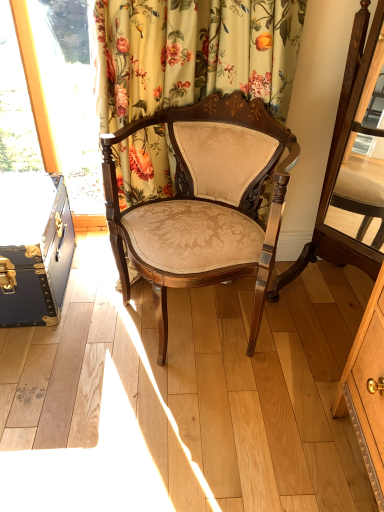
This screenshot has width=384, height=512. What do you see at coordinates (193, 54) in the screenshot?
I see `floral fabric curtain at upper center` at bounding box center [193, 54].

The width and height of the screenshot is (384, 512). What do you see at coordinates (34, 248) in the screenshot? I see `blue leather suitcase at left` at bounding box center [34, 248].

Find the location of a particular element. floral fabric curtain at upper center is located at coordinates (193, 54).

Are blue leather suitcase at left and floral fabric curtain at upper center far apart?

No, there isn't a large distance between blue leather suitcase at left and floral fabric curtain at upper center.

Is point (11, 312) closer or farther from the camera than point (229, 78)?

Clearly, point (11, 312) is more distant from the camera than point (229, 78).

From a real-world perspective, is blue leather suitcase at left positioned under floral fabric curtain at upper center based on gravity?

Yes.

In the scene shown: Is blue leather suitcase at left positioned with its back to floral fabric curtain at upper center?

blue leather suitcase at left does not have its back to floral fabric curtain at upper center.

From the image's perspective, between matte brown wood swivel chair at center and matte gold upholstery chair at center, which one is located above?

matte brown wood swivel chair at center, from the image's perspective.

Can you confirm if matte brown wood swivel chair at center is positioned to the left of matte gold upholstery chair at center?

No, matte brown wood swivel chair at center is not to the left of matte gold upholstery chair at center.

Considering the positions of objects matte brown wood swivel chair at center and matte gold upholstery chair at center in the image provided, who is behind, matte brown wood swivel chair at center or matte gold upholstery chair at center?

matte gold upholstery chair at center is further away from the camera.

Looking at this image, does matte brown wood swivel chair at center have a greater width compared to blue leather suitcase at left?

In fact, matte brown wood swivel chair at center might be narrower than blue leather suitcase at left.

Is matte brown wood swivel chair at center touching blue leather suitcase at left?

matte brown wood swivel chair at center and blue leather suitcase at left are clearly separated.

Is matte brown wood swivel chair at center further to the viewer compared to blue leather suitcase at left?

No, matte brown wood swivel chair at center is closer to the viewer.

Would you say matte gold upholstery chair at center is a long distance from blue leather suitcase at left?

No, matte gold upholstery chair at center is in close proximity to blue leather suitcase at left.

Is matte gold upholstery chair at center looking in the opposite direction of blue leather suitcase at left?

No, blue leather suitcase at left is not at the back of matte gold upholstery chair at center.

Is floral fabric curtain at upper center next to matte brown wood swivel chair at center and touching it?

They are not placed beside each other.

From the image's perspective, is floral fabric curtain at upper center under matte brown wood swivel chair at center?

No.

Could you tell me if floral fabric curtain at upper center is turned towards matte brown wood swivel chair at center?

No, floral fabric curtain at upper center is not oriented towards matte brown wood swivel chair at center.

The image size is (384, 512). I want to click on curtain on the left of the matte brown wood swivel chair at center, so [193, 54].

Which object is more forward, matte gold upholstery chair at center or matte brown wood swivel chair at center?

matte brown wood swivel chair at center is in front.

From the image's perspective, is matte gold upholstery chair at center beneath matte brown wood swivel chair at center?

Correct, matte gold upholstery chair at center appears lower than matte brown wood swivel chair at center in the image.

Between matte gold upholstery chair at center and matte brown wood swivel chair at center, which one has less height?

Standing shorter between the two is matte gold upholstery chair at center.

Would you consider matte gold upholstery chair at center to be distant from matte brown wood swivel chair at center?

No, matte gold upholstery chair at center is not far from matte brown wood swivel chair at center.

Find the location of a particular element. This screenshot has height=512, width=384. curtain above the blue leather suitcase at left (from the image's perspective) is located at coordinates (193, 54).

How much distance is there between floral fabric curtain at upper center and blue leather suitcase at left?

A distance of 21.71 inches exists between floral fabric curtain at upper center and blue leather suitcase at left.

Is floral fabric curtain at upper center oriented away from blue leather suitcase at left?

floral fabric curtain at upper center does not have its back to blue leather suitcase at left.

Does floral fabric curtain at upper center have a larger size compared to blue leather suitcase at left?

Yes, floral fabric curtain at upper center is bigger than blue leather suitcase at left.

At what (x,y) coordinates should I click in order to perform the action: click on box behind the floral fabric curtain at upper center. Please return your answer as a coordinate pair (x, y). The height and width of the screenshot is (512, 384). Looking at the image, I should click on (34, 248).

Locate an element on the screen. swivel chair located above the matte gold upholstery chair at center (from the image's perspective) is located at coordinates (352, 169).

Considering their positions, is matte gold upholstery chair at center positioned further to matte brown wood swivel chair at center than blue leather suitcase at left?

The object further to matte brown wood swivel chair at center is blue leather suitcase at left.

From the image, which object appears to be nearer to floral fabric curtain at upper center, matte gold upholstery chair at center or blue leather suitcase at left?

matte gold upholstery chair at center lies closer to floral fabric curtain at upper center than the other object.

Based on their spatial positions, is blue leather suitcase at left or matte brown wood swivel chair at center further from floral fabric curtain at upper center?

The object further to floral fabric curtain at upper center is blue leather suitcase at left.

Considering their positions, is matte brown wood swivel chair at center positioned closer to matte gold upholstery chair at center than blue leather suitcase at left?

matte brown wood swivel chair at center lies closer to matte gold upholstery chair at center than the other object.

When comparing their distances from matte brown wood swivel chair at center, does blue leather suitcase at left or floral fabric curtain at upper center seem further?

Based on the image, blue leather suitcase at left appears to be further to matte brown wood swivel chair at center.

When comparing their distances from floral fabric curtain at upper center, does blue leather suitcase at left or matte gold upholstery chair at center seem further?

blue leather suitcase at left.

Looking at the image, which one is located further to matte brown wood swivel chair at center, matte gold upholstery chair at center or floral fabric curtain at upper center?

floral fabric curtain at upper center is further to matte brown wood swivel chair at center.

In the scene shown: Which object lies further to the anchor point matte brown wood swivel chair at center, floral fabric curtain at upper center or matte gold upholstery chair at center?

The object further to matte brown wood swivel chair at center is floral fabric curtain at upper center.

This screenshot has width=384, height=512. I want to click on curtain situated between blue leather suitcase at left and matte brown wood swivel chair at center from left to right, so point(193,54).

This screenshot has height=512, width=384. What are the coordinates of `curtain between blue leather suitcase at left and matte gold upholstery chair at center from left to right` in the screenshot? It's located at (193, 54).

Find the location of a particular element. Image resolution: width=384 pixels, height=512 pixels. chair between blue leather suitcase at left and matte brown wood swivel chair at center from left to right is located at coordinates (205, 203).

Where is `chair situated between floral fabric curtain at upper center and matte brown wood swivel chair at center from left to right`? This screenshot has width=384, height=512. chair situated between floral fabric curtain at upper center and matte brown wood swivel chair at center from left to right is located at coordinates (205, 203).